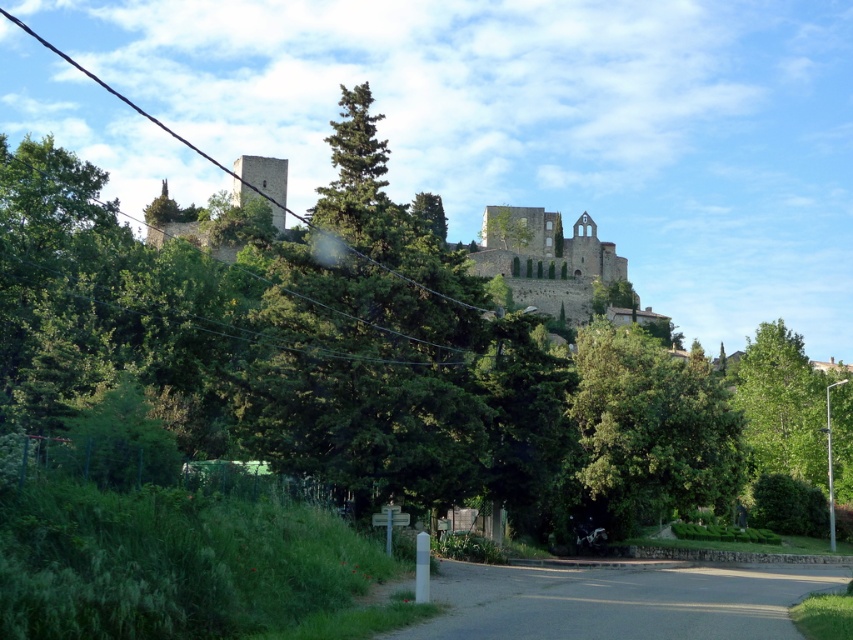
Is green leafy tree at upper center smaller than green leafy tree at center?

Actually, green leafy tree at upper center might be larger than green leafy tree at center.

Is point (746, 444) in front of point (643, 436)?

That is False.

I want to click on green leafy tree at upper center, so click(x=387, y=358).

Can you confirm if green leafy tree at upper center is shorter than stone castle at upper center?

No.

Can you confirm if green leafy tree at upper center is wider than stone castle at upper center?

No, green leafy tree at upper center is not wider than stone castle at upper center.

Is point (764, 522) behind point (241, 164)?

No, (764, 522) is closer to viewer.

Where is `green leafy tree at upper center`? The width and height of the screenshot is (853, 640). green leafy tree at upper center is located at coordinates (387, 358).

Does green leafy tree at center lie behind stone castle at upper center?

Yes, green leafy tree at center is further from the viewer.

Does green leafy tree at center have a greater width compared to stone castle at upper center?

No, green leafy tree at center is not wider than stone castle at upper center.

Is point (734, 420) more distant than point (584, 314)?

No, (734, 420) is in front of (584, 314).

Where is `green leafy tree at center`? This screenshot has height=640, width=853. green leafy tree at center is located at coordinates tap(653, 428).